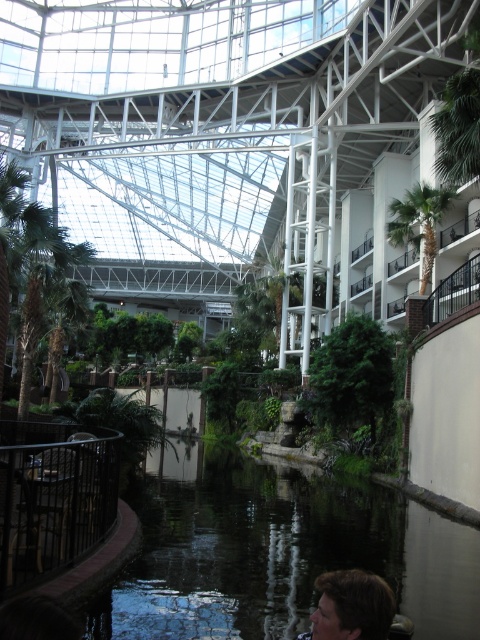
Consider the image. Can you confirm if smooth concrete pond at center is positioned above green leafy palm tree at upper right?

Actually, smooth concrete pond at center is below green leafy palm tree at upper right.

Is smooth concrete pond at center smaller than green leafy palm tree at upper right?

No.

Where is `smooth concrete pond at center`? This screenshot has height=640, width=480. smooth concrete pond at center is located at coordinates (277, 552).

Find the location of a particular element. smooth concrete pond at center is located at coordinates (277, 552).